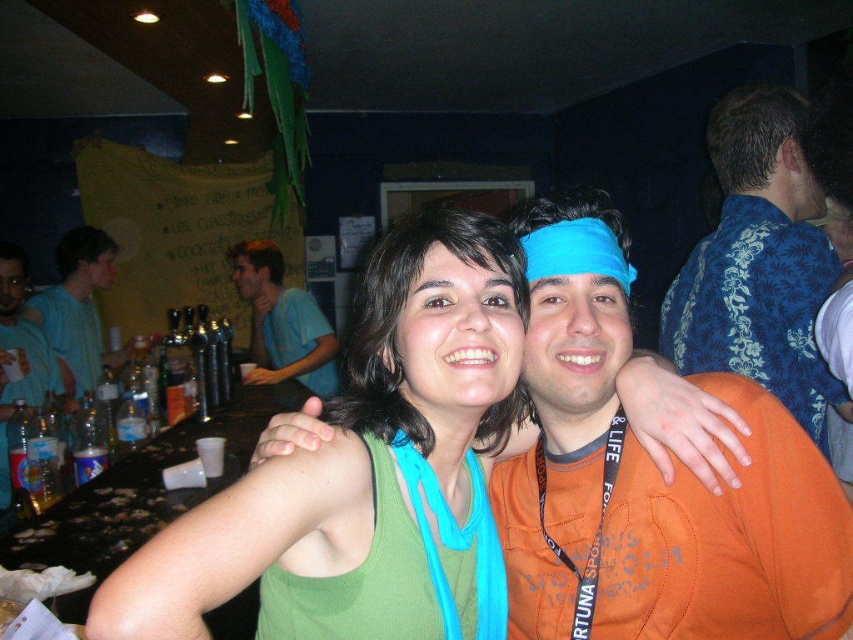
Question: Can you confirm if orange cotton shirt at center is positioned to the right of blue cotton shirt at center?

Choices:
 (A) no
 (B) yes

Answer: (B)

Question: Which object appears farthest from the camera in this image?

Choices:
 (A) orange cotton shirt at center
 (B) black fabric lanyard at upper center

Answer: (B)

Question: Which object is positioned farthest from the blue fabric lanyard at upper center?

Choices:
 (A) matte plastic bottle at left
 (B) matte blue shirt at left

Answer: (B)

Question: Is the position of blue floral shirt at upper right more distant than that of blue fabric lanyard at upper center?

Choices:
 (A) no
 (B) yes

Answer: (B)

Question: Can you confirm if matte blue shirt at left is positioned below black fabric lanyard at upper center?

Choices:
 (A) no
 (B) yes

Answer: (A)

Question: Which object is the farthest from the orange cotton shirt at center?

Choices:
 (A) blue cotton shirt at center
 (B) blue fabric lanyard at upper center

Answer: (A)